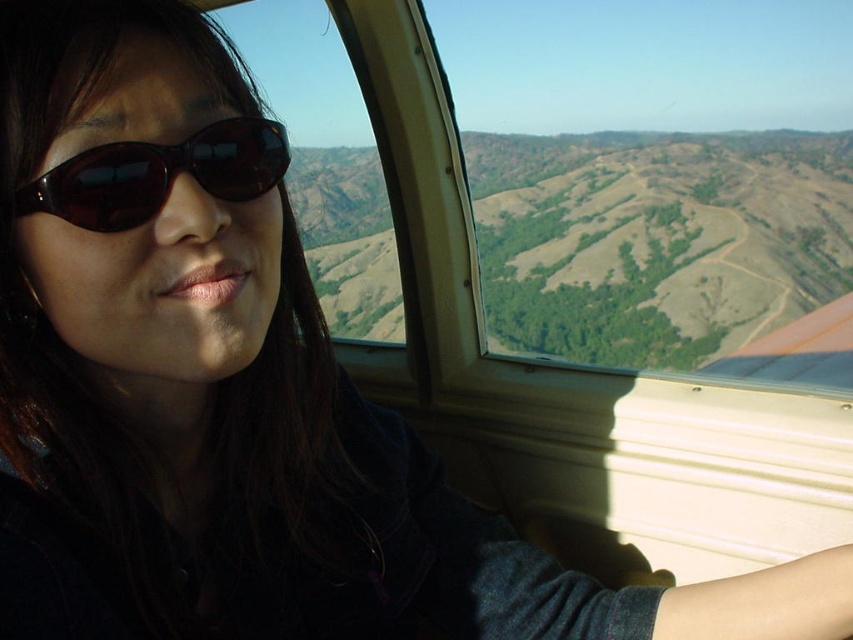
Which is in front, point (593, 156) or point (85, 157)?

Positioned in front is point (85, 157).

Who is more forward, (608, 182) or (115, 230)?

Point (115, 230) is in front.

Find the location of `transparent glass window at upper center`. transparent glass window at upper center is located at coordinates (659, 177).